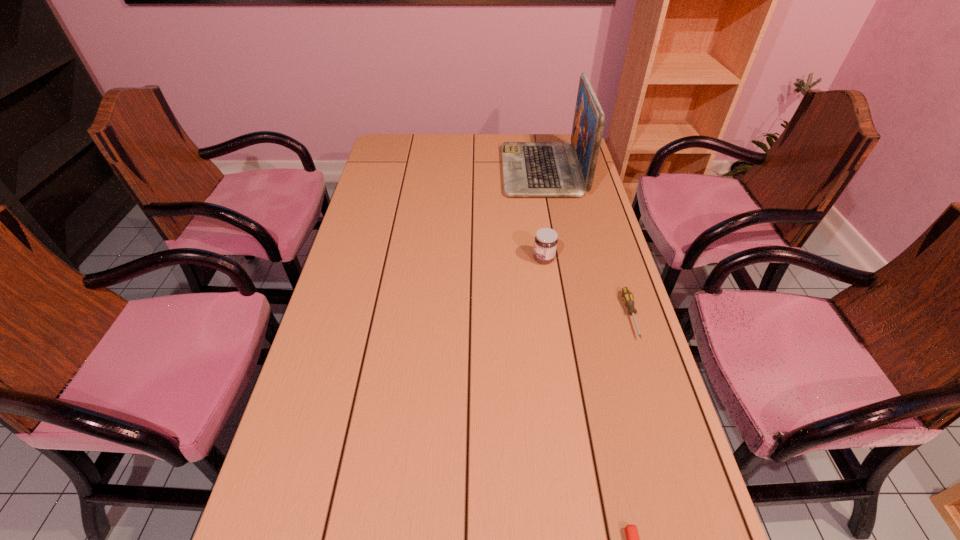
In the image, there is a desktop. Identify the location of free region at the far left corner. The height and width of the screenshot is (540, 960). point(402,158).

Find the location of a particular element. The image size is (960, 540). free spot between the laptop computer and the third nearest object is located at coordinates (543, 215).

At what (x,y) coordinates should I click in order to perform the action: click on free area in between the third tallest object and the jam. Please return your answer as a coordinate pair (x, y). This screenshot has height=540, width=960. Looking at the image, I should click on (588, 287).

Identify which object is the second nearest to the nearer screwdriver. Please provide its 2D coordinates. Your answer should be formatted as a tuple, i.e. [(x, y)], where the tuple contains the x and y coordinates of a point satisfying the conditions above.

[(545, 244)]

The width and height of the screenshot is (960, 540). In order to click on object that ranks as the third closest to the farther screwdriver in this screenshot , I will do `click(530, 169)`.